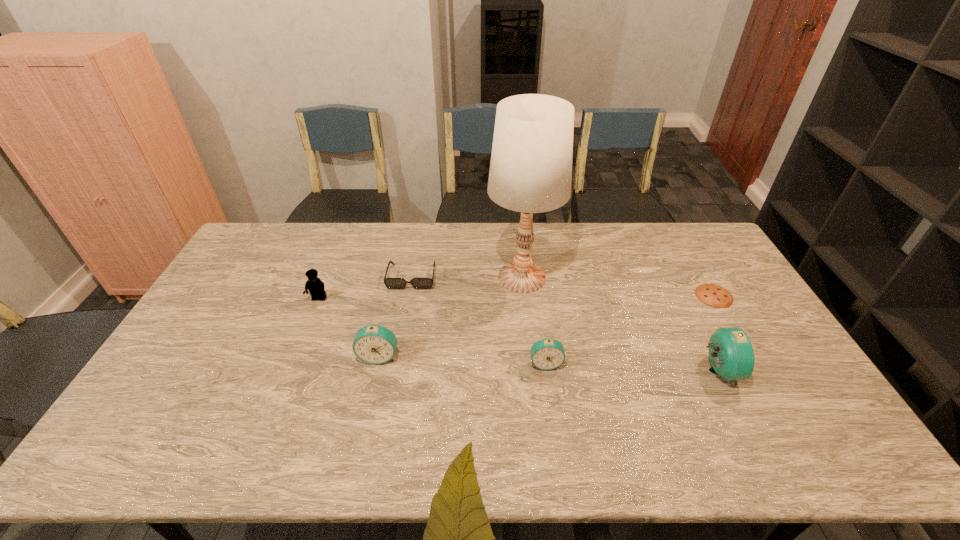
Find the location of a particular element. The height and width of the screenshot is (540, 960). vacant place for an extra alarm clock on the left is located at coordinates (217, 349).